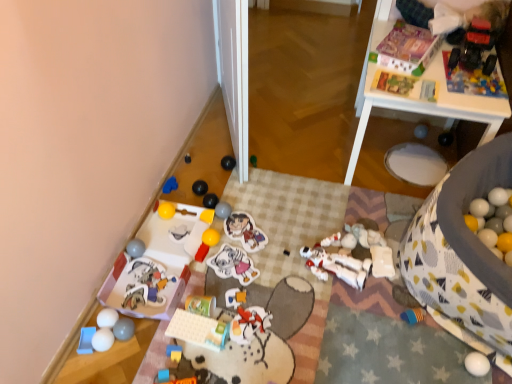
I want to click on empty space that is ontop of white glossy table at upper right, so click(442, 67).